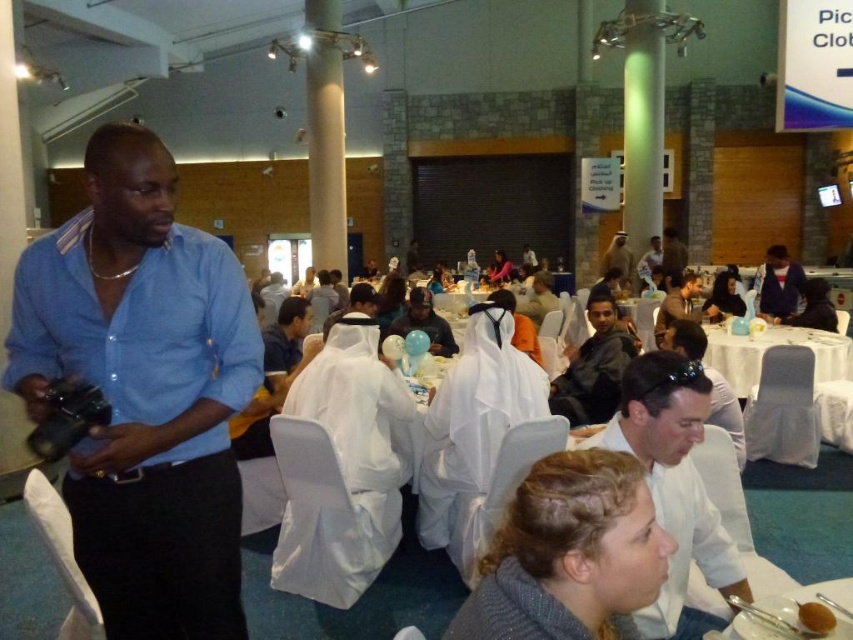
Is white glossy plate at lower right in front of matte black shirt at center?

That is True.

Does white glossy plate at lower right have a larger size compared to matte black shirt at center?

Incorrect, white glossy plate at lower right is not larger than matte black shirt at center.

At what (x,y) coordinates should I click in order to perform the action: click on white glossy plate at lower right. Please return your answer as a coordinate pair (x, y). This screenshot has height=640, width=853. Looking at the image, I should click on (807, 598).

Who is positioned more to the left, dark gray fabric jacket at center or light brown leather jacket at center?

light brown leather jacket at center

Does dark gray fabric jacket at center have a larger size compared to light brown leather jacket at center?

Correct, dark gray fabric jacket at center is larger in size than light brown leather jacket at center.

Who is more forward, (618, 358) or (302, 337)?

Point (618, 358) is more forward.

Identify the location of dark gray fabric jacket at center. This screenshot has width=853, height=640. (593, 365).

Which is below, dark gray fabric jacket at center or brown matte cup at lower right?

Positioned lower is brown matte cup at lower right.

Between dark gray fabric jacket at center and brown matte cup at lower right, which one has less height?

brown matte cup at lower right

This screenshot has width=853, height=640. Describe the element at coordinates (593, 365) in the screenshot. I see `dark gray fabric jacket at center` at that location.

Locate an element on the screen. The height and width of the screenshot is (640, 853). dark gray fabric jacket at center is located at coordinates (593, 365).